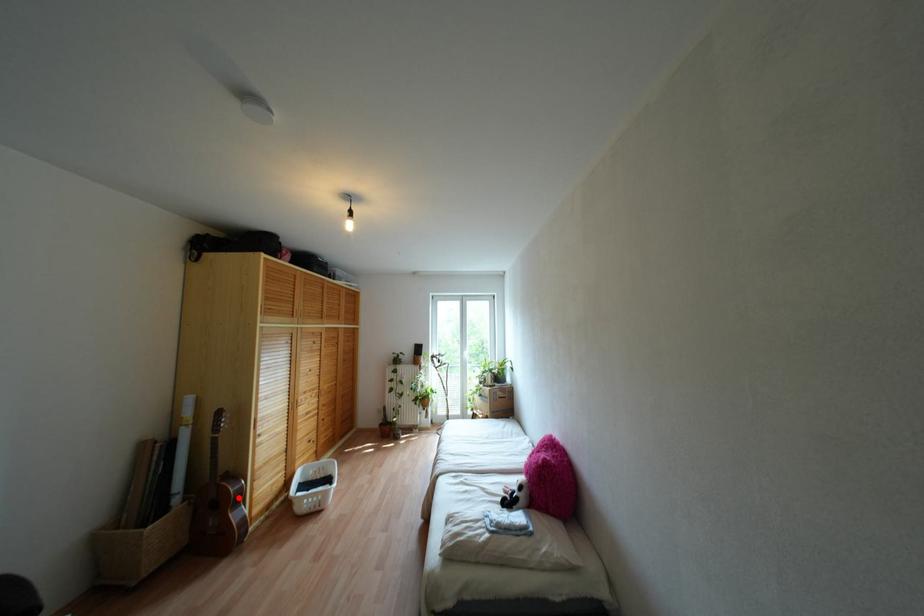
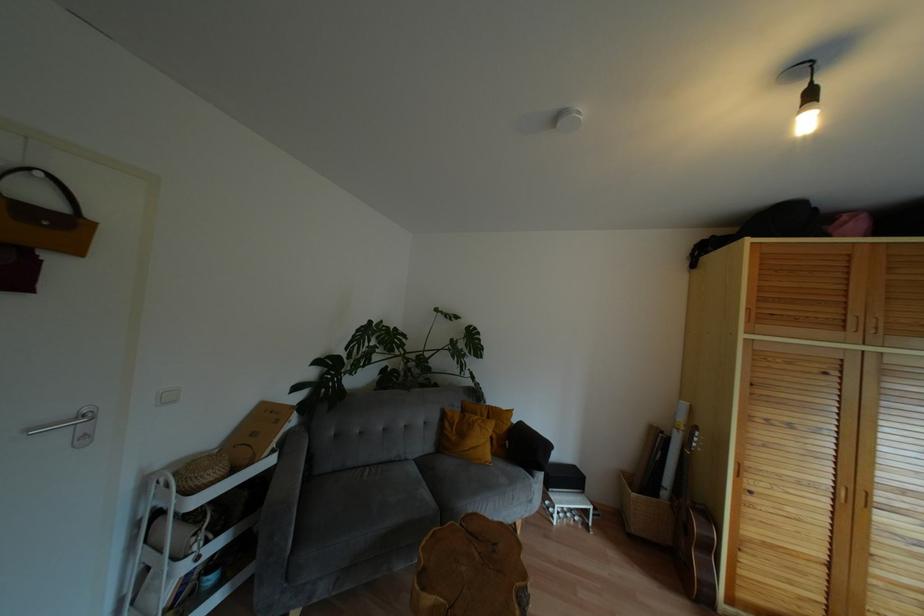
Question: I am providing you with two images of the same scene from different viewpoints. Image1 has a red point marked. In image2, the corresponding 3D location appears at what relative position? Reply with the corresponding letter.

Choices:
 (A) Closer
 (B) Farther

Answer: (A)